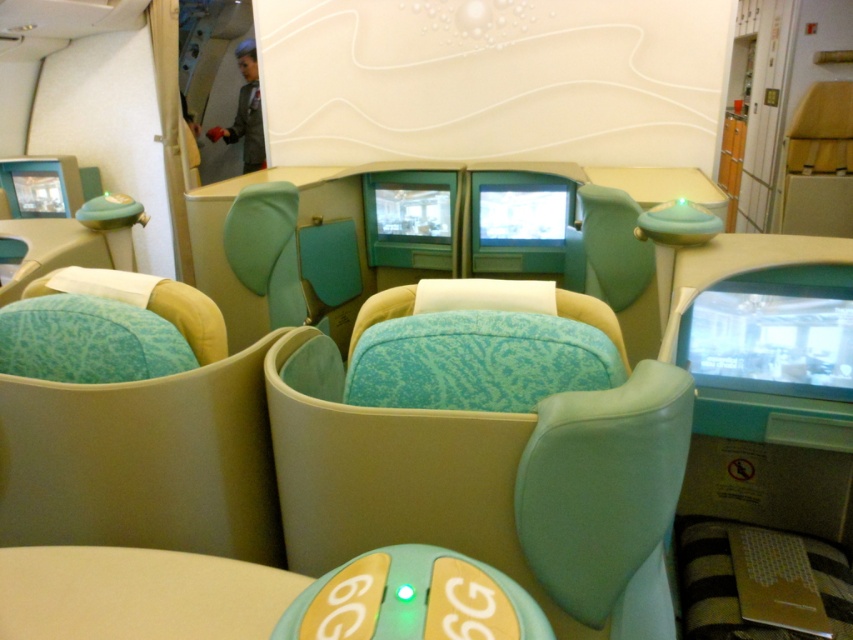
Question: Among these objects, which one is nearest to the camera?

Choices:
 (A) textured teal cushion at center
 (B) teal fabric seat at center
 (C) turquoise fabric seat at center

Answer: (C)

Question: Is turquoise fabric seat at center below textured teal cushion at center?

Choices:
 (A) yes
 (B) no

Answer: (A)

Question: Is turquoise fabric seat at center below textured teal cushion at center?

Choices:
 (A) no
 (B) yes

Answer: (B)

Question: Which of the following is the farthest from the observer?

Choices:
 (A) (640, 506)
 (B) (276, 333)

Answer: (B)

Question: Which point is farther to the camera?

Choices:
 (A) textured teal cushion at center
 (B) turquoise fabric seat at center

Answer: (A)

Question: Does turquoise fabric seat at center have a larger size compared to teal fabric seat at center?

Choices:
 (A) no
 (B) yes

Answer: (B)